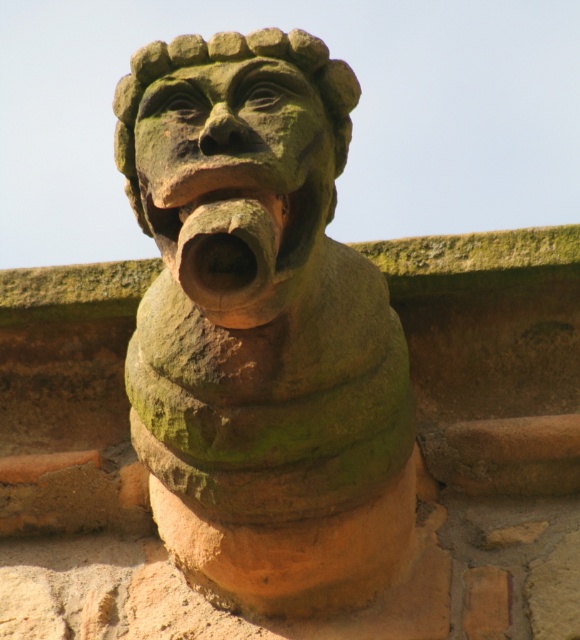
The width and height of the screenshot is (580, 640). What do you see at coordinates (262, 330) in the screenshot?
I see `green stone gargoyle at center` at bounding box center [262, 330].

The height and width of the screenshot is (640, 580). What do you see at coordinates (262, 330) in the screenshot? I see `green stone gargoyle at center` at bounding box center [262, 330].

Where is `green stone gargoyle at center`? Image resolution: width=580 pixels, height=640 pixels. green stone gargoyle at center is located at coordinates (262, 330).

Is green stone head at center above earthy clay mouth at center?

Yes, green stone head at center is above earthy clay mouth at center.

Does point (166, 252) come behind point (211, 273)?

That is True.

In order to click on green stone head at center in this screenshot , I will do point(234,161).

Identify the location of green stone head at center. (234, 161).

Is green stone gargoyle at center to the right of green stone head at center from the viewer's perspective?

In fact, green stone gargoyle at center is to the left of green stone head at center.

Can you confirm if green stone gargoyle at center is wider than green stone head at center?

Correct, the width of green stone gargoyle at center exceeds that of green stone head at center.

Describe the element at coordinates (262, 330) in the screenshot. This screenshot has width=580, height=640. I see `green stone gargoyle at center` at that location.

Find the location of `green stone gargoyle at center`. green stone gargoyle at center is located at coordinates (262, 330).